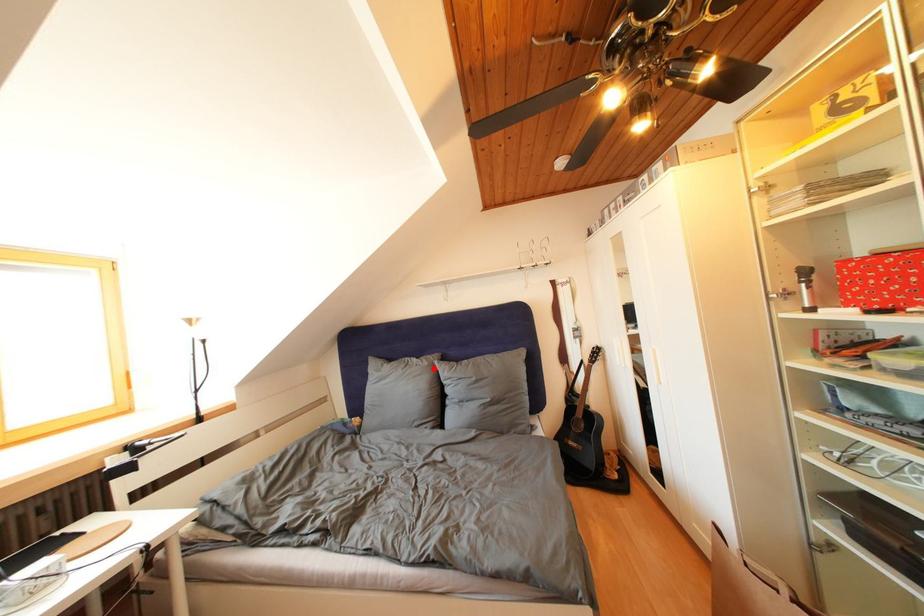
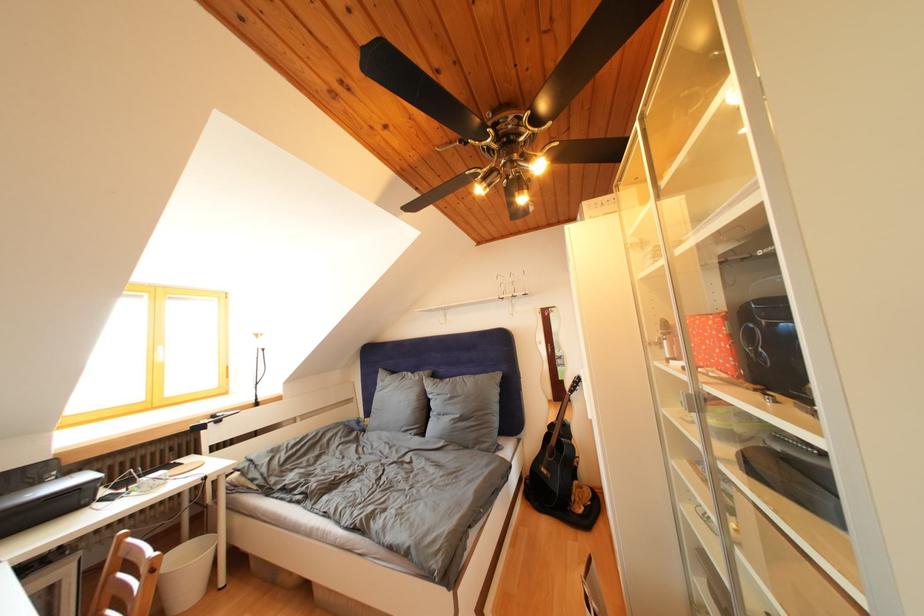
Where in the second image is the point corresponding to the highlighted location from the first image?

(426, 383)